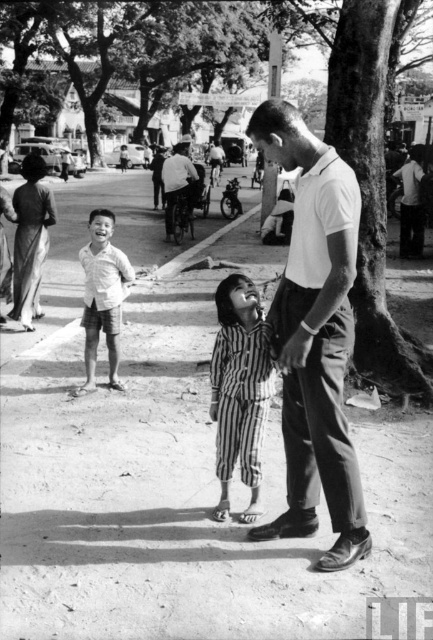
Question: Can you confirm if striped fabric at center is thinner than white cotton shirt at center?

Choices:
 (A) no
 (B) yes

Answer: (B)

Question: Considering the real-world distances, which object is farthest from the striped fabric at center?

Choices:
 (A) white cotton shirt at center
 (B) white smooth shirt at center

Answer: (A)

Question: Which point is closer to the camera taking this photo?

Choices:
 (A) (248, 440)
 (B) (184, 145)

Answer: (A)

Question: Is white smooth shirt at center closer to the viewer compared to light beige cotton shirt at center?

Choices:
 (A) no
 (B) yes

Answer: (B)

Question: Which is nearer to the smooth white shirt at center?

Choices:
 (A) light beige cotton shirt at center
 (B) white smooth shirt at center
 (C) white cotton shirt at center

Answer: (C)

Question: Does white smooth shirt at center appear under light beige cotton shirt at center?

Choices:
 (A) no
 (B) yes

Answer: (B)